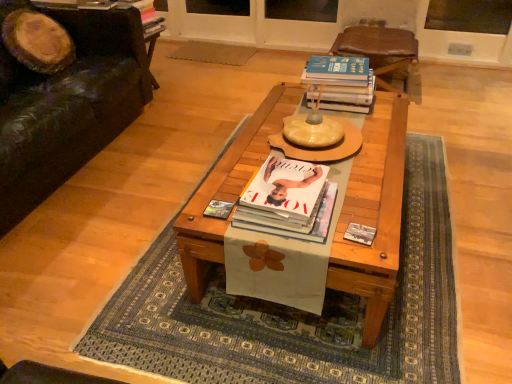
This screenshot has width=512, height=384. What do you see at coordinates (360, 234) in the screenshot?
I see `gray matte paperback book at center` at bounding box center [360, 234].

What is the approximate width of black leather couch at left?

The width of black leather couch at left is 37.69 inches.

The image size is (512, 384). Describe the element at coordinates (295, 312) in the screenshot. I see `white paper with flower design at center` at that location.

I want to click on white paper with flower design at center, so click(x=295, y=312).

Identify the location of matte yellow round table at center. This screenshot has width=512, height=384. (324, 149).

How many degrees apart are the facing directions of matte yellow round table at center and white glossy book at center, the 1th book from the bottom?

matte yellow round table at center and white glossy book at center, the 1th book from the bottom, are facing 0.00132 degrees away from each other.

Considering the points (345, 137) and (248, 227), which point is behind, point (345, 137) or point (248, 227)?

The point (345, 137) is farther.

Can you confirm if matte yellow round table at center is thinner than white glossy book at center, which is counted as the 2th book, starting from the right?

No.

From a real-world perspective, is matte yellow round table at center under white glossy book at center, acting as the 2th book starting from the top?

No.

Is the position of white glossy book at center, the 1th book from the bottom, less distant than that of brown leather chair at upper center?

Yes, white glossy book at center, the 1th book from the bottom, is closer to the camera.

Considering the relative positions of white glossy book at center, acting as the 2th book starting from the top, and brown leather chair at upper center in the image provided, is white glossy book at center, acting as the 2th book starting from the top, to the right of brown leather chair at upper center from the viewer's perspective?

In fact, white glossy book at center, acting as the 2th book starting from the top, is to the left of brown leather chair at upper center.

Is white glossy book at center, which appears as the first book when viewed from the left, beside brown leather chair at upper center?

white glossy book at center, which appears as the first book when viewed from the left, is not next to brown leather chair at upper center, and they're not touching.

Locate an element on the screen. The height and width of the screenshot is (384, 512). chair lying on the right of white glossy book at center, the 2th book from the back is located at coordinates (380, 51).

From the image's perspective, is wooden coffee table at center located above or below matte paper magazine at center?

From the image's perspective, wooden coffee table at center appears above matte paper magazine at center.

Which of these two, wooden coffee table at center or matte paper magazine at center, is bigger?

With larger size is wooden coffee table at center.

Is point (385, 220) positioned after point (233, 203)?

No, it is not.

Considering the positions of objects gray matte paperback book at center and white paper with flower design at center in the image provided, who is behind, gray matte paperback book at center or white paper with flower design at center?

gray matte paperback book at center is further away from the camera.

From a real-world perspective, is gray matte paperback book at center on top of white paper with flower design at center?

Correct, in the physical world, gray matte paperback book at center is higher than white paper with flower design at center.

Looking at this image, which is closer to the camera, (351,237) or (449,330)?

Positioned in front is point (351,237).

How far apart are gray matte paperback book at center and white paper with flower design at center?

gray matte paperback book at center and white paper with flower design at center are 65.03 centimeters apart.

Is white glossy book at center, which ranks as the 1th book in front-to-back order, in contact with gray matte paperback book at center?

white glossy book at center, which ranks as the 1th book in front-to-back order, is not next to gray matte paperback book at center, and they're not touching.

Which point is more distant from viewer, (239, 213) or (368, 234)?

The point (368, 234) is more distant.

In the scene shown: Is white glossy book at center, the 2th book from the back, not within gray matte paperback book at center?

Yes, white glossy book at center, the 2th book from the back, is outside of gray matte paperback book at center.

From the image's perspective, relative to gray matte paperback book at center, is white glossy book at center, which is counted as the 2th book, starting from the right, above or below?

Based on their image positions, white glossy book at center, which is counted as the 2th book, starting from the right, is located above gray matte paperback book at center.

Is white glossy book at center, which is counted as the 2th book, starting from the right, oriented away from white paper with flower design at center?

No, white glossy book at center, which is counted as the 2th book, starting from the right, is not facing away from white paper with flower design at center.

From a real-world perspective, which is physically below, white glossy book at center, acting as the 2th book starting from the top, or white paper with flower design at center?

In real-world perspective, white paper with flower design at center is lower.

From the image's perspective, which one is positioned higher, white glossy book at center, the 2th book from the back, or white paper with flower design at center?

white glossy book at center, the 2th book from the back.

How many degrees apart are the facing directions of white glossy book at center, the 1th book from the bottom, and wooden coffee table at center?

They differ by 180 degrees in their facing directions.

From a real-world perspective, who is located lower, white glossy book at center, the 2th book from the back, or wooden coffee table at center?

In real-world perspective, wooden coffee table at center is lower.

Which object is positioned more to the right, white glossy book at center, which is counted as the 2th book, starting from the right, or wooden coffee table at center?

Positioned to the right is wooden coffee table at center.

Which is less distant, (x=288, y=221) or (x=216, y=251)?

The point (x=288, y=221) is closer.

Identify the location of round table behind the white glossy book at center, the 2th book from the back. (324, 149).

I want to click on chair below the white glossy book at center, which is counted as the 2th book, starting from the right (from a real-world perspective), so click(x=380, y=51).

Looking at the image, which one is located closer to white glossy book at center, which ranks as the 1th book in front-to-back order, brown leather chair at upper center or white paper with flower design at center?

white paper with flower design at center lies closer to white glossy book at center, which ranks as the 1th book in front-to-back order, than the other object.

Which object lies further to the anchor point hardcover book at upper right, which is counted as the second book, starting from the front, gray matte paperback book at center or matte yellow round table at center?

gray matte paperback book at center lies further to hardcover book at upper right, which is counted as the second book, starting from the front, than the other object.

Estimate the real-world distances between objects in this image. Which object is further from brown leather chair at upper center, white glossy book at center, which ranks as the 1th book in front-to-back order, or gray matte paperback book at center?

Among the two, gray matte paperback book at center is located further to brown leather chair at upper center.

Which object lies nearer to the anchor point hardcover book at upper right, the second book from the bottom, white glossy book at center, acting as the 2th book starting from the top, or matte yellow round table at center?

Among the two, matte yellow round table at center is located nearer to hardcover book at upper right, the second book from the bottom.

From the image, which object appears to be farther from black leather couch at left, matte paper magazine at center or white glossy book at center, which ranks as the 1th book in front-to-back order?

The object further to black leather couch at left is matte paper magazine at center.

When comparing their distances from brown leather chair at upper center, does black leather couch at left or matte paper magazine at center seem further?

A: matte paper magazine at center.

Considering their positions, is hardcover book at upper right, the second book from the bottom, positioned closer to gray matte paperback book at center than black leather couch at left?

The object closer to gray matte paperback book at center is hardcover book at upper right, the second book from the bottom.

From the picture: Estimate the real-world distances between objects in this image. Which object is further from gray matte paperback book at center, matte paper magazine at center or white glossy book at center, the 1th book from the bottom?

matte paper magazine at center is positioned further to the anchor gray matte paperback book at center.

This screenshot has height=384, width=512. I want to click on coffee table between white glossy book at center, the 1th book from the bottom, and gray matte paperback book at center, in the horizontal direction, so click(x=373, y=213).

In order to click on magazine between black leather couch at left and white paper with flower design at center in this screenshot , I will do `click(218, 209)`.

Where is `round table that lies between hardcover book at upper right, the second book from the bottom, and matte paper magazine at center from top to bottom`? round table that lies between hardcover book at upper right, the second book from the bottom, and matte paper magazine at center from top to bottom is located at coordinates (324, 149).

Find the location of a particular element. This screenshot has height=384, width=512. book located between black leather couch at left and wooden coffee table at center in the left-right direction is located at coordinates point(288,201).